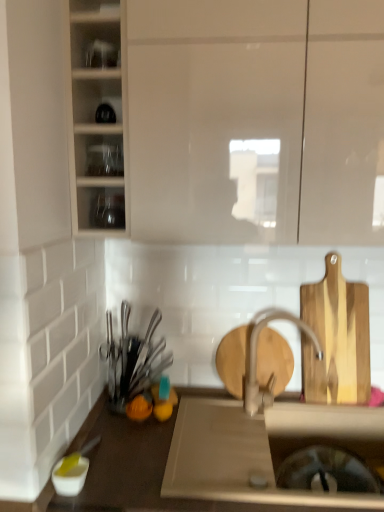
Locate an element on the screen. This screenshot has width=384, height=512. blank space to the left of matte silver faucet at center is located at coordinates (228, 421).